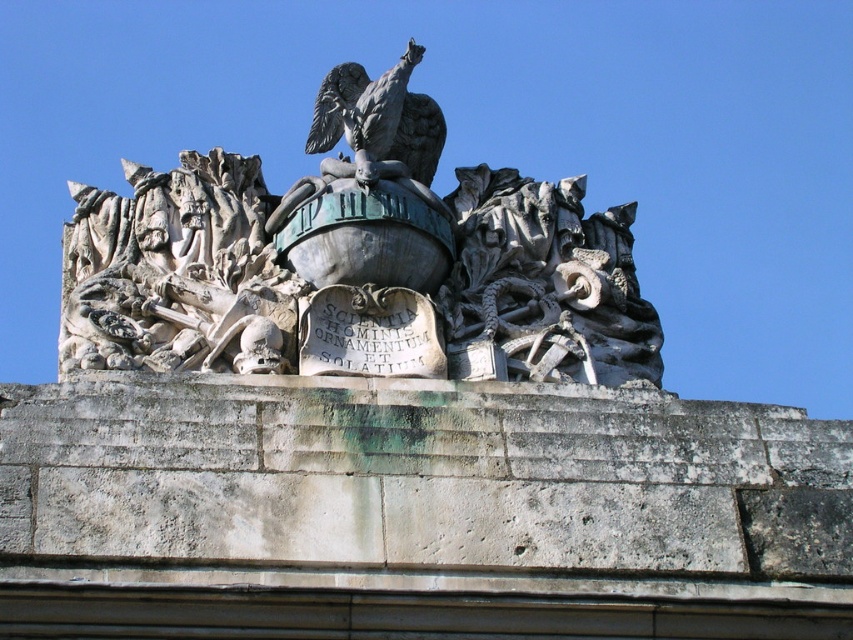
Can you confirm if stone sculpture at center is smaller than white stone sculpture at upper center?

No.

Between stone sculpture at center and white stone sculpture at upper center, which one is positioned lower?

white stone sculpture at upper center is below.

Does point (339, 234) lie in front of point (192, 192)?

That is True.

This screenshot has width=853, height=640. In order to click on stone sculpture at center in this screenshot , I will do (357, 260).

Is white stone sculpture at upper center thinner than bronze eagle at upper center?

Incorrect, white stone sculpture at upper center's width is not less than bronze eagle at upper center's.

Which is more to the right, white stone sculpture at upper center or bronze eagle at upper center?

Positioned to the right is bronze eagle at upper center.

Identify the location of white stone sculpture at upper center. The image size is (853, 640). (177, 273).

Can you confirm if stone sculpture at center is positioned above bronze eagle at upper center?

Yes, stone sculpture at center is above bronze eagle at upper center.

Does stone sculpture at center appear on the right side of bronze eagle at upper center?

Correct, you'll find stone sculpture at center to the right of bronze eagle at upper center.

Image resolution: width=853 pixels, height=640 pixels. Identify the location of stone sculpture at center. (357, 260).